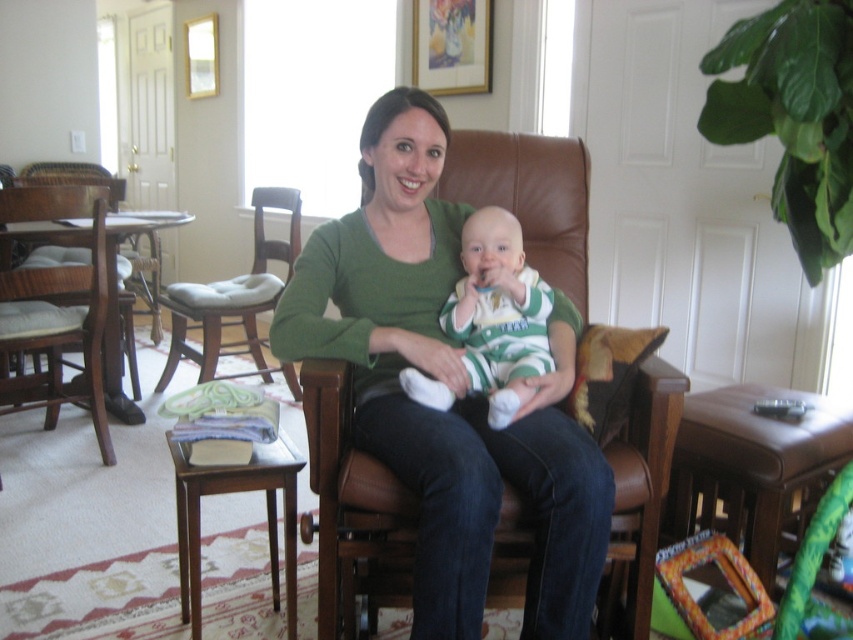
You are a photographer setting up a shoot in this room. You need to place a small prop exactly at the coordinates given for the green matte shirt at center. Where should you place the prop relative to the room?

The green matte shirt at center is located at coordinates 0.605 on the x axis and 0.529 on the y axis, so place the prop at those coordinates relative to the room.

Consider the image. You are a photographer setting up for a family portrait. You have to decide where to place the lighting equipment. The green matte shirt at center and the brown wood chair at left are in the scene. Which object should you place the spotlight closer to if you want the spotlight to highlight the object that is nearer to the camera?

The green matte shirt at center is closer to the viewer than the brown wood chair at left, so you should place the spotlight closer to the green matte shirt at center to highlight the nearer object.